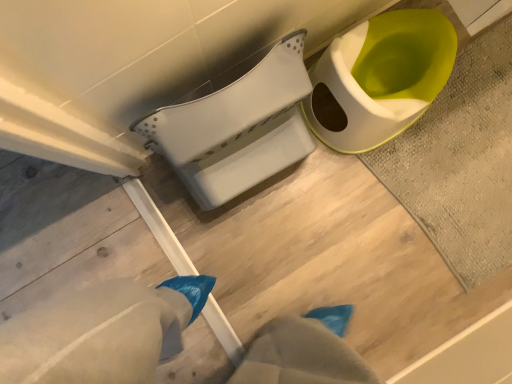
What are the coordinates of `matte white toilet at upper right, the second toilet in the left-to-right sequence` in the screenshot? It's located at (382, 77).

The height and width of the screenshot is (384, 512). Identify the location of white plastic toilet at center, which ranks as the second toilet in right-to-left order. (237, 128).

In order to face textured gray bath mat at upper right, should I rotate leftwards or rightwards?

A 28.667 degree turn to the right will do.

Measure the distance between textured gray bath mat at upper right and camera.

The distance of textured gray bath mat at upper right from camera is 1.07 meters.

Identify the location of matte white toilet at upper right, which is counted as the 1th toilet, starting from the right. (382, 77).

Is white plastic toilet at center, arranged as the 1th toilet when viewed from the left, not within matte white toilet at upper right, the second toilet in the left-to-right sequence?

Yes.

Does white plastic toilet at center, which ranks as the second toilet in right-to-left order, have a greater height compared to matte white toilet at upper right, the second toilet in the left-to-right sequence?

Indeed, white plastic toilet at center, which ranks as the second toilet in right-to-left order, has a greater height compared to matte white toilet at upper right, the second toilet in the left-to-right sequence.

Consider the image. Is white plastic toilet at center, arranged as the 1th toilet when viewed from the left, smaller than matte white toilet at upper right, which is counted as the 1th toilet, starting from the right?

No, white plastic toilet at center, arranged as the 1th toilet when viewed from the left, is not smaller than matte white toilet at upper right, which is counted as the 1th toilet, starting from the right.

From the image's perspective, which one is positioned higher, white plastic toilet at center, which ranks as the second toilet in right-to-left order, or matte white toilet at upper right, which is counted as the 1th toilet, starting from the right?

matte white toilet at upper right, which is counted as the 1th toilet, starting from the right.

This screenshot has height=384, width=512. I want to click on the 2nd toilet to the left of the textured gray bath mat at upper right, counting from the anchor's position, so click(237, 128).

Could you measure the distance between textured gray bath mat at upper right and white plastic toilet at center, arranged as the 1th toilet when viewed from the left?

The distance of textured gray bath mat at upper right from white plastic toilet at center, arranged as the 1th toilet when viewed from the left, is 16.92 inches.

Could you tell me if textured gray bath mat at upper right is facing white plastic toilet at center, which ranks as the second toilet in right-to-left order?

No, textured gray bath mat at upper right is not aimed at white plastic toilet at center, which ranks as the second toilet in right-to-left order.

Is textured gray bath mat at upper right not within white plastic toilet at center, arranged as the 1th toilet when viewed from the left?

Yes, textured gray bath mat at upper right is located beyond the bounds of white plastic toilet at center, arranged as the 1th toilet when viewed from the left.

How many degrees apart are the facing directions of textured gray bath mat at upper right and matte white toilet at upper right, the second toilet in the left-to-right sequence?

There is a 90-degree angle between the facing directions of textured gray bath mat at upper right and matte white toilet at upper right, the second toilet in the left-to-right sequence.

Is textured gray bath mat at upper right not inside matte white toilet at upper right, the second toilet in the left-to-right sequence?

Yes.

Is textured gray bath mat at upper right behind matte white toilet at upper right, which is counted as the 1th toilet, starting from the right?

That is True.

Between textured gray bath mat at upper right and matte white toilet at upper right, the second toilet in the left-to-right sequence, which one appears on the right side from the viewer's perspective?

Positioned to the right is textured gray bath mat at upper right.

Is matte white toilet at upper right, the second toilet in the left-to-right sequence, wider or thinner than textured gray bath mat at upper right?

In the image, matte white toilet at upper right, the second toilet in the left-to-right sequence, appears to be more narrow than textured gray bath mat at upper right.

Is matte white toilet at upper right, which is counted as the 1th toilet, starting from the right, at the left side of textured gray bath mat at upper right?

Correct, you'll find matte white toilet at upper right, which is counted as the 1th toilet, starting from the right, to the left of textured gray bath mat at upper right.

Which is nearer, (418, 35) or (489, 77)?

The point (418, 35) is in front.

From a real-world perspective, does matte white toilet at upper right, which is counted as the 1th toilet, starting from the right, stand above textured gray bath mat at upper right?

Yes, from a real-world perspective, matte white toilet at upper right, which is counted as the 1th toilet, starting from the right, is above textured gray bath mat at upper right.

Is white plastic toilet at center, arranged as the 1th toilet when viewed from the left, inside matte white toilet at upper right, which is counted as the 1th toilet, starting from the right?

No, white plastic toilet at center, arranged as the 1th toilet when viewed from the left, is not a part of matte white toilet at upper right, which is counted as the 1th toilet, starting from the right.

Are matte white toilet at upper right, the second toilet in the left-to-right sequence, and white plastic toilet at center, which ranks as the second toilet in right-to-left order, making contact?

No, matte white toilet at upper right, the second toilet in the left-to-right sequence, is not making contact with white plastic toilet at center, which ranks as the second toilet in right-to-left order.

Locate an element on the screen. This screenshot has height=384, width=512. toilet that is above the matte white toilet at upper right, the second toilet in the left-to-right sequence (from a real-world perspective) is located at coordinates (237, 128).

Based on the photo, what's the angular difference between matte white toilet at upper right, which is counted as the 1th toilet, starting from the right, and white plastic toilet at center, which ranks as the second toilet in right-to-left order,'s facing directions?

They differ by 2.62e-05 degrees in their facing directions.

Is point (159, 141) closer to viewer compared to point (386, 184)?

Yes.

Which object is thinner, white plastic toilet at center, which ranks as the second toilet in right-to-left order, or textured gray bath mat at upper right?

white plastic toilet at center, which ranks as the second toilet in right-to-left order.

Which of these two, white plastic toilet at center, which ranks as the second toilet in right-to-left order, or textured gray bath mat at upper right, is bigger?

white plastic toilet at center, which ranks as the second toilet in right-to-left order, is bigger.

You are a GUI agent. You are given a task and a screenshot of the screen. Output one action in this format:
    pyautogui.click(x=<x>, y=<y>)
    Task: Click on the toilet in front of the matte white toilet at upper right, the second toilet in the left-to-right sequence
    
    Given the screenshot: What is the action you would take?
    pyautogui.click(x=237, y=128)

Locate an element on the screen. bath mat below the white plastic toilet at center, arranged as the 1th toilet when viewed from the left (from the image's perspective) is located at coordinates (461, 161).

Consider the image. Based on their spatial positions, is matte white toilet at upper right, the second toilet in the left-to-right sequence, or textured gray bath mat at upper right closer to white plastic toilet at center, which ranks as the second toilet in right-to-left order?

Among the two, matte white toilet at upper right, the second toilet in the left-to-right sequence, is located nearer to white plastic toilet at center, which ranks as the second toilet in right-to-left order.

Considering their positions, is white plastic toilet at center, which ranks as the second toilet in right-to-left order, positioned further to matte white toilet at upper right, the second toilet in the left-to-right sequence, than textured gray bath mat at upper right?

white plastic toilet at center, which ranks as the second toilet in right-to-left order, is positioned further to the anchor matte white toilet at upper right, the second toilet in the left-to-right sequence.

From the image, which object appears to be farther from textured gray bath mat at upper right, matte white toilet at upper right, which is counted as the 1th toilet, starting from the right, or white plastic toilet at center, which ranks as the second toilet in right-to-left order?

white plastic toilet at center, which ranks as the second toilet in right-to-left order, lies further to textured gray bath mat at upper right than the other object.

Based on their spatial positions, is textured gray bath mat at upper right or white plastic toilet at center, which ranks as the second toilet in right-to-left order, further from matte white toilet at upper right, the second toilet in the left-to-right sequence?

white plastic toilet at center, which ranks as the second toilet in right-to-left order, is positioned further to the anchor matte white toilet at upper right, the second toilet in the left-to-right sequence.

When comparing their distances from textured gray bath mat at upper right, does white plastic toilet at center, arranged as the 1th toilet when viewed from the left, or matte white toilet at upper right, which is counted as the 1th toilet, starting from the right, seem further?

Based on the image, white plastic toilet at center, arranged as the 1th toilet when viewed from the left, appears to be further to textured gray bath mat at upper right.

From the image, which object appears to be farther from white plastic toilet at center, arranged as the 1th toilet when viewed from the left, textured gray bath mat at upper right or matte white toilet at upper right, which is counted as the 1th toilet, starting from the right?

textured gray bath mat at upper right.

The height and width of the screenshot is (384, 512). Find the location of `toilet between white plastic toilet at center, which ranks as the second toilet in right-to-left order, and textured gray bath mat at upper right`. toilet between white plastic toilet at center, which ranks as the second toilet in right-to-left order, and textured gray bath mat at upper right is located at coordinates (382, 77).